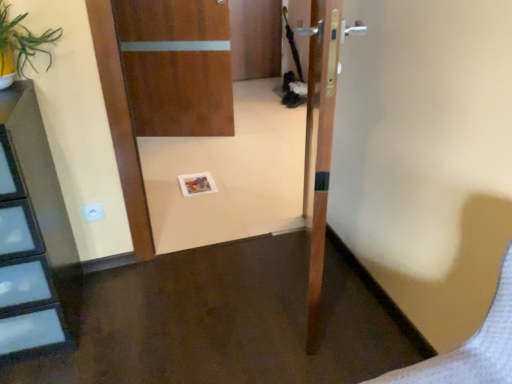
Question: From a real-world perspective, is green leafy plant at upper left located higher than white plastic electric outlet at lower left?

Choices:
 (A) yes
 (B) no

Answer: (A)

Question: Considering the relative sizes of green leafy plant at upper left and white plastic electric outlet at lower left in the image provided, is green leafy plant at upper left bigger than white plastic electric outlet at lower left?

Choices:
 (A) no
 (B) yes

Answer: (B)

Question: Is green leafy plant at upper left thinner than white plastic electric outlet at lower left?

Choices:
 (A) yes
 (B) no

Answer: (B)

Question: Could you tell me if green leafy plant at upper left is turned towards white plastic electric outlet at lower left?

Choices:
 (A) yes
 (B) no

Answer: (B)

Question: Is green leafy plant at upper left directly adjacent to white plastic electric outlet at lower left?

Choices:
 (A) yes
 (B) no

Answer: (B)

Question: In terms of height, does white plastic electric outlet at lower left look taller or shorter compared to green leafy plant at upper left?

Choices:
 (A) short
 (B) tall

Answer: (A)

Question: In the image, is white plastic electric outlet at lower left on the left side or the right side of green leafy plant at upper left?

Choices:
 (A) right
 (B) left

Answer: (A)

Question: Do you think white plastic electric outlet at lower left is within green leafy plant at upper left, or outside of it?

Choices:
 (A) inside
 (B) outside

Answer: (B)

Question: Considering the positions of white plastic electric outlet at lower left and green leafy plant at upper left in the image, is white plastic electric outlet at lower left bigger or smaller than green leafy plant at upper left?

Choices:
 (A) big
 (B) small

Answer: (B)

Question: From a real-world perspective, is wooden door at center, the 2th door viewed from the right, above or below wooden door at center, the second door when ordered from left to right?

Choices:
 (A) above
 (B) below

Answer: (B)

Question: Is wooden door at center, arranged as the 1th door when viewed from the left, spatially inside wooden door at center, marked as the first door in a front-to-back arrangement, or outside of it?

Choices:
 (A) inside
 (B) outside

Answer: (B)

Question: From the image's perspective, relative to wooden door at center, which ranks as the first door in right-to-left order, is wooden door at center, arranged as the 1th door when viewed from the left, above or below?

Choices:
 (A) above
 (B) below

Answer: (A)

Question: In terms of size, does wooden door at center, placed as the 1th door when sorted from back to front, appear bigger or smaller than wooden door at center, which is counted as the second door, starting from the back?

Choices:
 (A) small
 (B) big

Answer: (A)

Question: From a real-world perspective, is wooden door at center, which ranks as the first door in right-to-left order, positioned above or below green leafy plant at upper left?

Choices:
 (A) below
 (B) above

Answer: (A)

Question: Based on their positions, is wooden door at center, which is counted as the second door, starting from the back, located to the left or right of green leafy plant at upper left?

Choices:
 (A) left
 (B) right

Answer: (B)